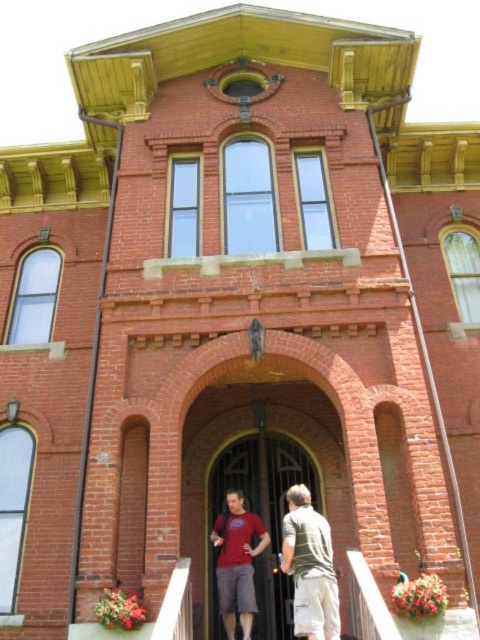
Which is behind, point (285, 451) or point (240, 518)?

The point (285, 451) is behind.

Who is higher up, black metal door at center or matte red t-shirt at center?

black metal door at center is above.

Does point (233, 458) lie in front of point (217, 520)?

No.

Locate an element on the screen. The width and height of the screenshot is (480, 640). black metal door at center is located at coordinates (264, 513).

Is black metal door at center positioned before green textured shirt at center?

That is False.

Describe the element at coordinates (264, 513) in the screenshot. The image size is (480, 640). I see `black metal door at center` at that location.

Where is `black metal door at center`? black metal door at center is located at coordinates (264, 513).

Is green textured shirt at center positioned before matte red t-shirt at center?

Yes, it is in front of matte red t-shirt at center.

Can you confirm if green textured shirt at center is positioned below matte red t-shirt at center?

Actually, green textured shirt at center is above matte red t-shirt at center.

Who is more distant from viewer, (317,577) or (218,568)?

Positioned behind is point (218,568).

Where is `green textured shirt at center`? This screenshot has height=640, width=480. green textured shirt at center is located at coordinates (310, 566).